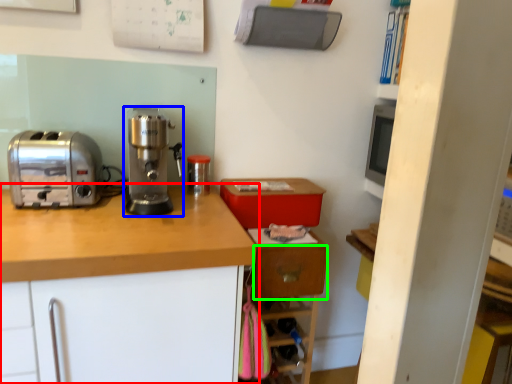
Question: Estimate the real-world distances between objects in this image. Which object is farther from cabinetry (highlighted by a red box), home appliance (highlighted by a blue box) or drawer (highlighted by a green box)?

Choices:
 (A) home appliance
 (B) drawer

Answer: (B)